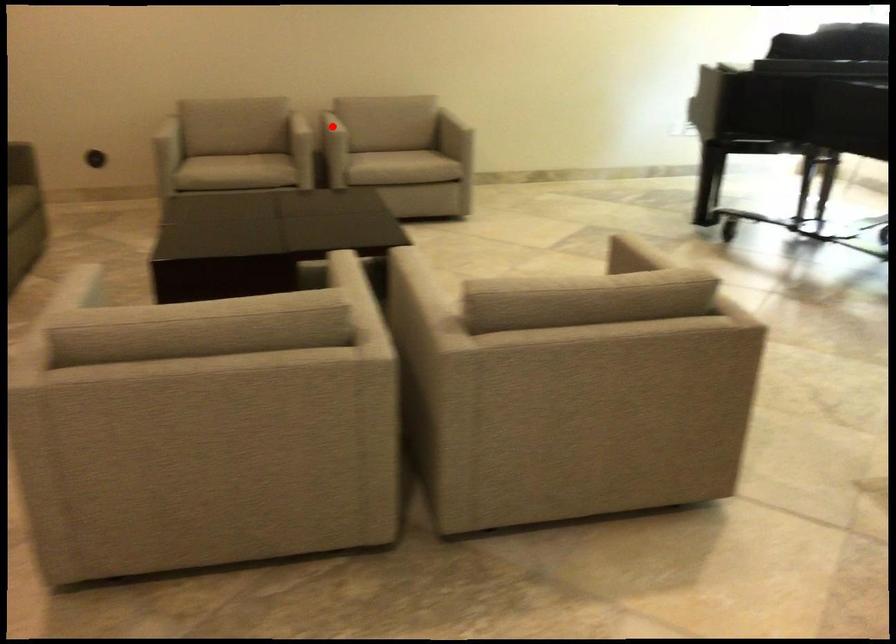
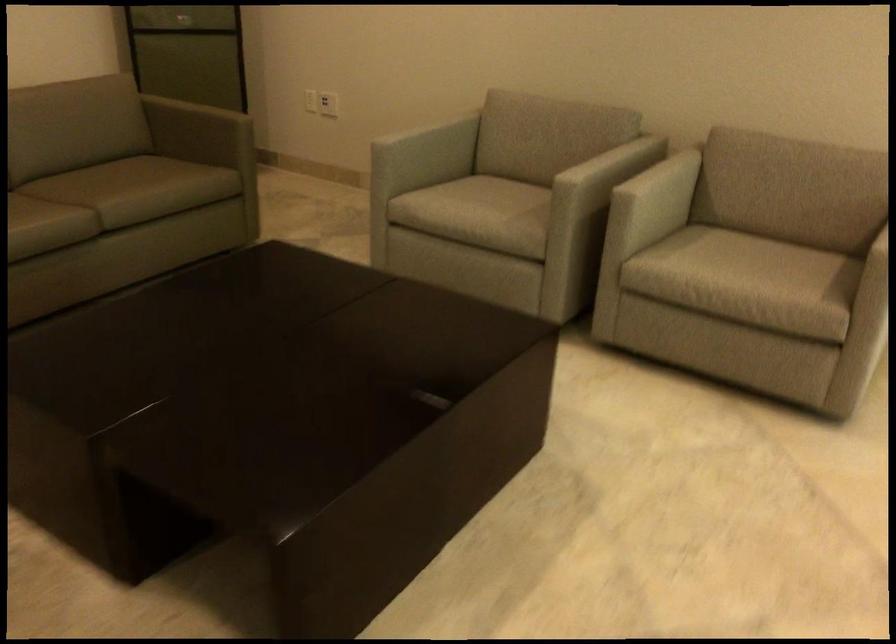
Locate, in the second image, the point that corresponds to the highlighted location in the first image.

(661, 187)